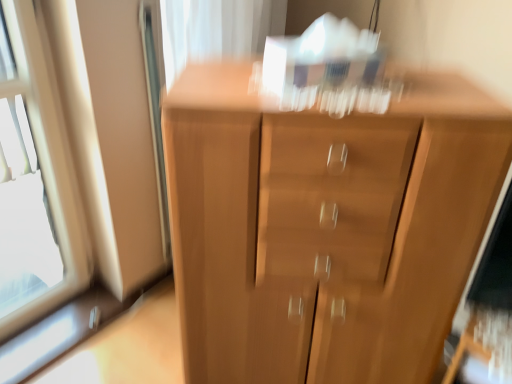
I want to click on light brown wood chest of drawers at center, so click(x=326, y=223).

The image size is (512, 384). What do you see at coordinates (326, 223) in the screenshot?
I see `light brown wood chest of drawers at center` at bounding box center [326, 223].

The height and width of the screenshot is (384, 512). In order to click on light brown wood chest of drawers at center in this screenshot , I will do 326,223.